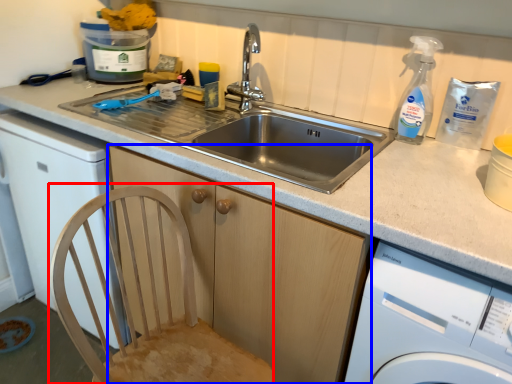
Question: Which object is further to the camera taking this photo, feeding chair (highlighted by a red box) or cabinetry (highlighted by a blue box)?

Choices:
 (A) feeding chair
 (B) cabinetry

Answer: (B)